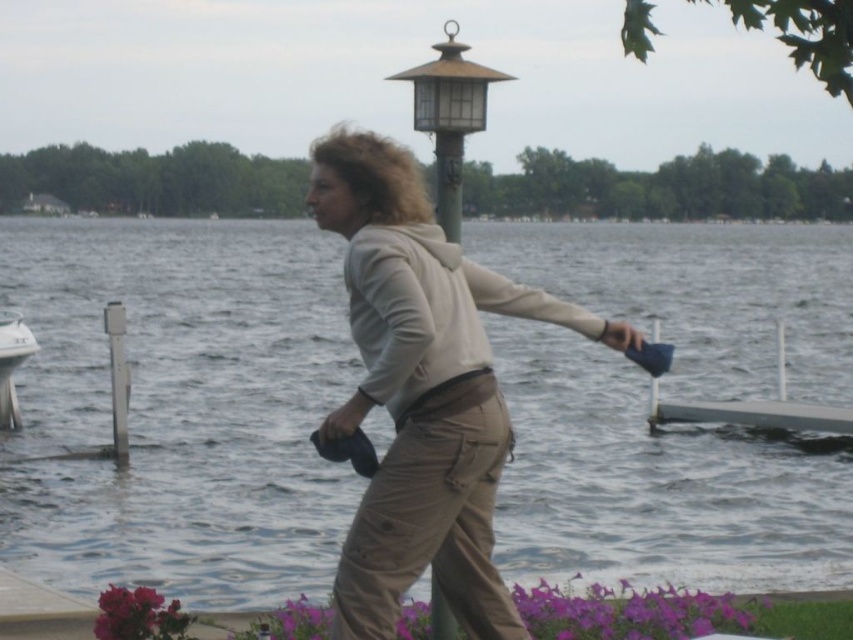
You are a photographer trying to capture the white plastic boat at left and the beige cotton hoodie at center in the same frame. Which object should you focus on first if you want to ensure both are in focus without adjusting your camera settings?

The beige cotton hoodie at center is taller than the white plastic boat at left, so focusing on the beige cotton hoodie at center first will help ensure both are in focus since it is larger and closer to the camera.

You are standing at the water edge and want to place a small boat in the clear water at center. However, there is a metallic gold lamp post at upper center nearby. Which object is located to the left of the lamp post?

The clear water at center is positioned on the left side of metallic gold lamp post at upper center, so the clear water at center is to the left of the lamp post.